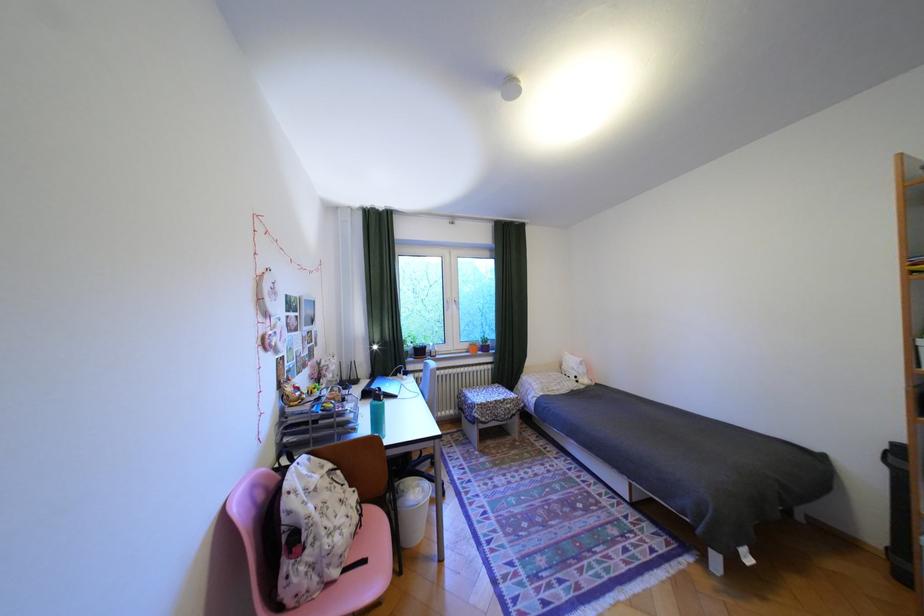
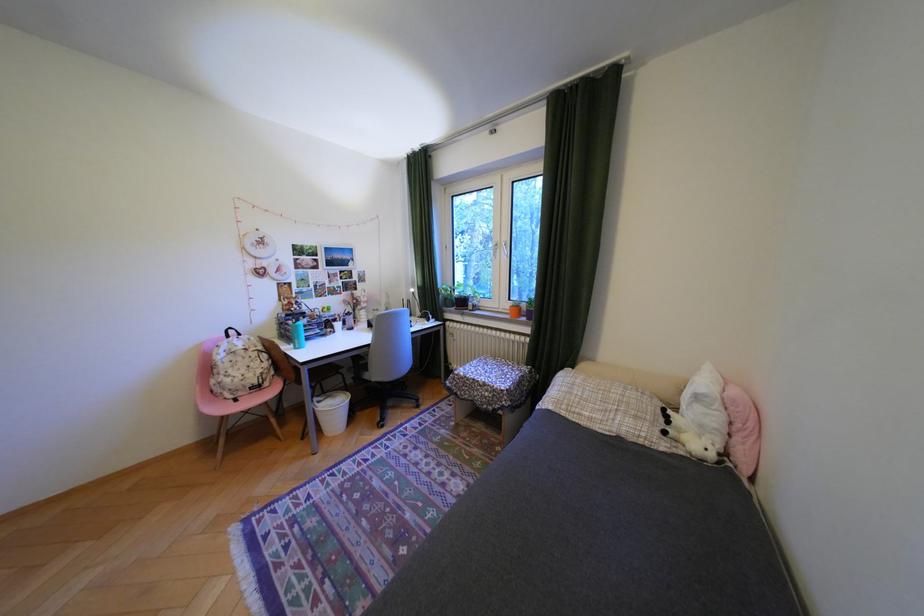
In the second image, find the point that corresponds to point (360, 424) in the first image.

(300, 331)